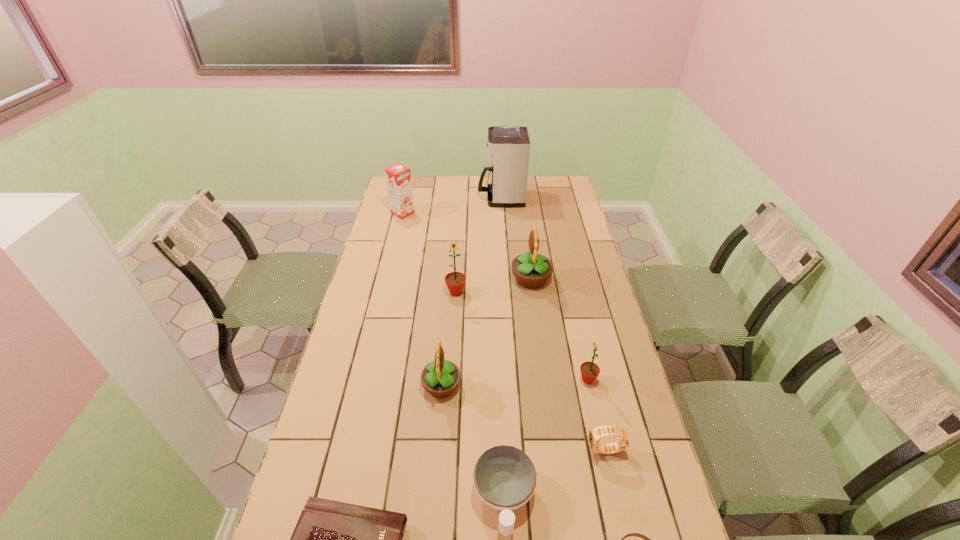
Locate an element on the screen. The image size is (960, 540). the tallest object is located at coordinates (508, 146).

At what (x,y) coordinates should I click in order to perform the action: click on carton. Please return your answer as a coordinate pair (x, y). Image resolution: width=960 pixels, height=540 pixels. Looking at the image, I should click on (398, 177).

Identify the location of the bigger yellow sunflower. Image resolution: width=960 pixels, height=540 pixels. (531, 270).

Find the location of a particular element. The height and width of the screenshot is (540, 960). the farther yellow sunflower is located at coordinates (531, 270).

This screenshot has height=540, width=960. What are the coordinates of `the farther green sunflower` in the screenshot? It's located at (455, 281).

The width and height of the screenshot is (960, 540). I want to click on the bigger green sunflower, so click(455, 281).

Locate an element on the screen. Image resolution: width=960 pixels, height=540 pixels. the nearer yellow sunflower is located at coordinates (440, 378).

This screenshot has height=540, width=960. In order to click on the smaller yellow sunflower in this screenshot , I will do `click(440, 378)`.

Where is `the rightmost sunflower`? the rightmost sunflower is located at coordinates (589, 371).

Identify the location of the nearer green sunflower. (589, 371).